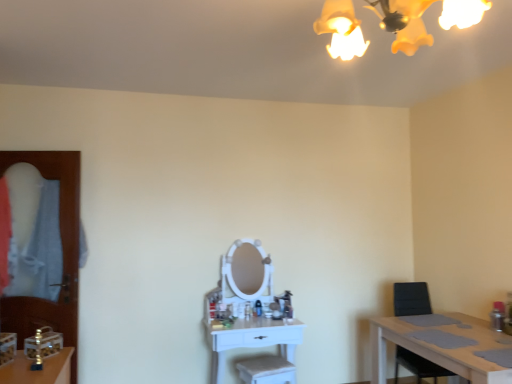
Question: Is light brown wooden table at lower right, acting as the 1th table starting from the right, to the right of transparent wooden door at left from the viewer's perspective?

Choices:
 (A) yes
 (B) no

Answer: (A)

Question: From the image's perspective, would you say light brown wooden table at lower right, acting as the 1th table starting from the right, is positioned over transparent wooden door at left?

Choices:
 (A) yes
 (B) no

Answer: (B)

Question: Is light brown wooden table at lower right, the second table in the left-to-right sequence, not close to transparent wooden door at left?

Choices:
 (A) yes
 (B) no

Answer: (A)

Question: Are light brown wooden table at lower right, acting as the 1th table starting from the right, and transparent wooden door at left beside each other?

Choices:
 (A) no
 (B) yes

Answer: (A)

Question: From the image's perspective, does light brown wooden table at lower right, acting as the 1th table starting from the right, appear lower than transparent wooden door at left?

Choices:
 (A) no
 (B) yes

Answer: (B)

Question: From a real-world perspective, is transparent wooden door at left above or below light brown wooden table at lower right, the second table in the left-to-right sequence?

Choices:
 (A) below
 (B) above

Answer: (B)

Question: In terms of width, does transparent wooden door at left look wider or thinner when compared to light brown wooden table at lower right, acting as the 1th table starting from the right?

Choices:
 (A) wide
 (B) thin

Answer: (B)

Question: Looking at the image, does transparent wooden door at left seem bigger or smaller compared to light brown wooden table at lower right, acting as the 1th table starting from the right?

Choices:
 (A) big
 (B) small

Answer: (B)

Question: From the image's perspective, is transparent wooden door at left above or below light brown wooden table at lower right, acting as the 1th table starting from the right?

Choices:
 (A) above
 (B) below

Answer: (A)

Question: Which is correct: light brown wooden table at lower right, the second table in the left-to-right sequence, is inside yellow matte light fixture at upper center, or outside of it?

Choices:
 (A) outside
 (B) inside

Answer: (A)

Question: Is light brown wooden table at lower right, the second table in the left-to-right sequence, in front of or behind yellow matte light fixture at upper center in the image?

Choices:
 (A) behind
 (B) front

Answer: (A)

Question: Visually, is light brown wooden table at lower right, acting as the 1th table starting from the right, positioned to the left or to the right of yellow matte light fixture at upper center?

Choices:
 (A) right
 (B) left

Answer: (A)

Question: Looking at their shapes, would you say light brown wooden table at lower right, the second table in the left-to-right sequence, is wider or thinner than yellow matte light fixture at upper center?

Choices:
 (A) thin
 (B) wide

Answer: (B)

Question: From the image's perspective, is white glossy vanity at center, the 1th table from the left, located above or below light brown wooden table at lower right, the second table in the left-to-right sequence?

Choices:
 (A) above
 (B) below

Answer: (B)

Question: In the image, is white glossy vanity at center, the 1th table from the left, positioned in front of or behind light brown wooden table at lower right, acting as the 1th table starting from the right?

Choices:
 (A) behind
 (B) front

Answer: (A)